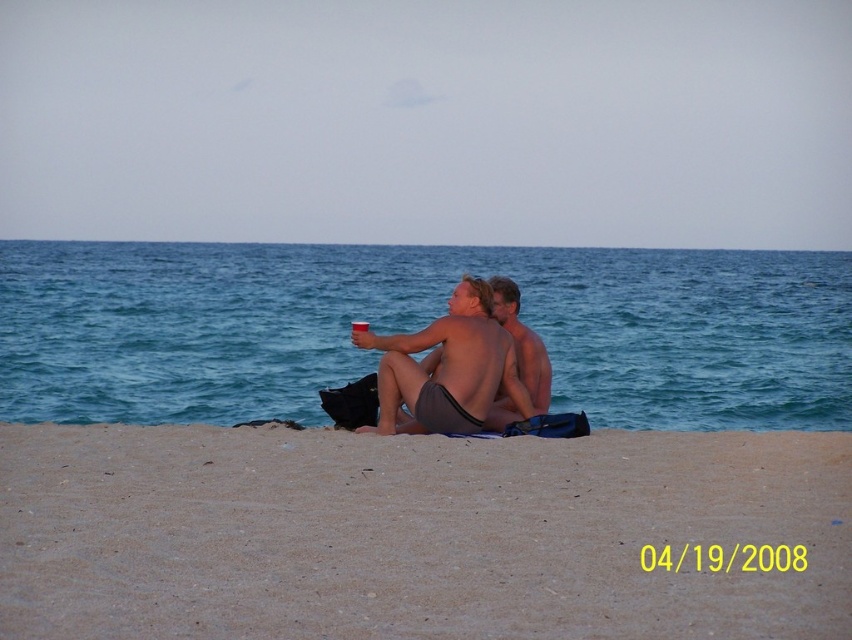
Question: Can you confirm if matte skin at center is thinner than smooth skin torso at center?

Choices:
 (A) yes
 (B) no

Answer: (B)

Question: Which object is closer to the camera taking this photo?

Choices:
 (A) brown sand at lower center
 (B) matte skin at center

Answer: (A)

Question: Is brown sand at lower center further to camera compared to smooth skin torso at center?

Choices:
 (A) no
 (B) yes

Answer: (A)

Question: Is the position of matte skin at center less distant than that of smooth skin torso at center?

Choices:
 (A) no
 (B) yes

Answer: (B)

Question: Which object is the farthest from the matte skin at center?

Choices:
 (A) smooth skin torso at center
 (B) brown sand at lower center

Answer: (B)

Question: Which point appears farthest from the camera in this image?

Choices:
 (A) (370, 621)
 (B) (424, 432)

Answer: (B)